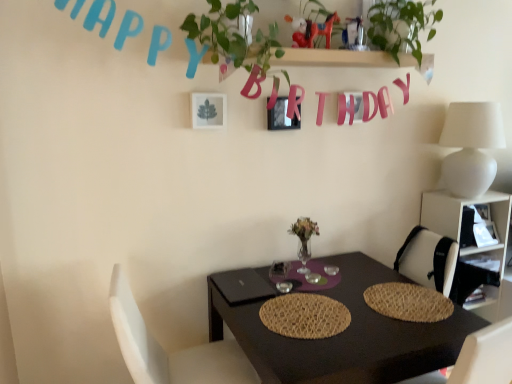
Question: Considering the relative sizes of green leafy plant at upper right and woven straw placemat at center, the 1th mat from the right, in the image provided, is green leafy plant at upper right shorter than woven straw placemat at center, the 1th mat from the right,?

Choices:
 (A) no
 (B) yes

Answer: (A)

Question: From the image's perspective, would you say green leafy plant at upper right is shown under woven straw placemat at center, the second mat positioned from the left?

Choices:
 (A) no
 (B) yes

Answer: (A)

Question: Considering the relative sizes of green leafy plant at upper right and woven straw placemat at center, the second mat positioned from the left, in the image provided, is green leafy plant at upper right bigger than woven straw placemat at center, the second mat positioned from the left,?

Choices:
 (A) yes
 (B) no

Answer: (A)

Question: Can you confirm if green leafy plant at upper right is wider than woven straw placemat at center, the 1th mat from the right?

Choices:
 (A) no
 (B) yes

Answer: (A)

Question: Is green leafy plant at upper right next to woven straw placemat at center, the second mat positioned from the left, and touching it?

Choices:
 (A) no
 (B) yes

Answer: (A)

Question: Does green leafy plant at upper right lie in front of woven straw placemat at center, the 1th mat from the right?

Choices:
 (A) yes
 (B) no

Answer: (B)

Question: Is metallic silver picture frame at upper center, which is the 1th picture frame in back-to-front order, shorter than green leafy plant at upper center?

Choices:
 (A) no
 (B) yes

Answer: (B)

Question: Can you confirm if metallic silver picture frame at upper center, which is the 1th picture frame in right-to-left order, is wider than green leafy plant at upper center?

Choices:
 (A) yes
 (B) no

Answer: (B)

Question: Does metallic silver picture frame at upper center, arranged as the second picture frame when viewed from the left, contain green leafy plant at upper center?

Choices:
 (A) yes
 (B) no

Answer: (B)

Question: Is metallic silver picture frame at upper center, which is counted as the second picture frame, starting from the front, smaller than green leafy plant at upper center?

Choices:
 (A) no
 (B) yes

Answer: (B)

Question: Is metallic silver picture frame at upper center, which is the 1th picture frame in right-to-left order, not close to green leafy plant at upper center?

Choices:
 (A) no
 (B) yes

Answer: (A)

Question: Is metallic silver picture frame at upper center, arranged as the second picture frame when viewed from the left, behind green leafy plant at upper center?

Choices:
 (A) no
 (B) yes

Answer: (B)

Question: Is woven straw placemat at center, the second mat positioned from the left, not inside white plastic shelf at right?

Choices:
 (A) no
 (B) yes

Answer: (B)